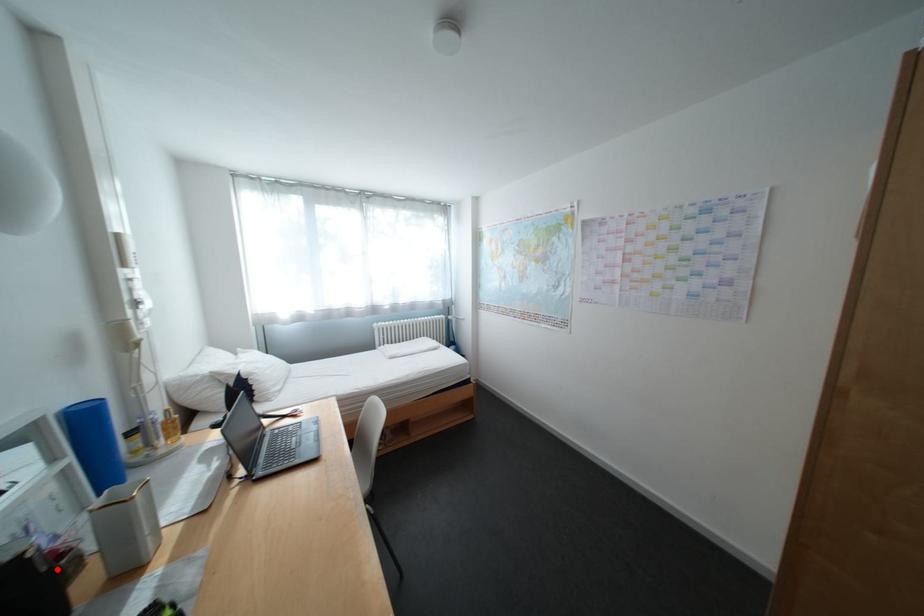
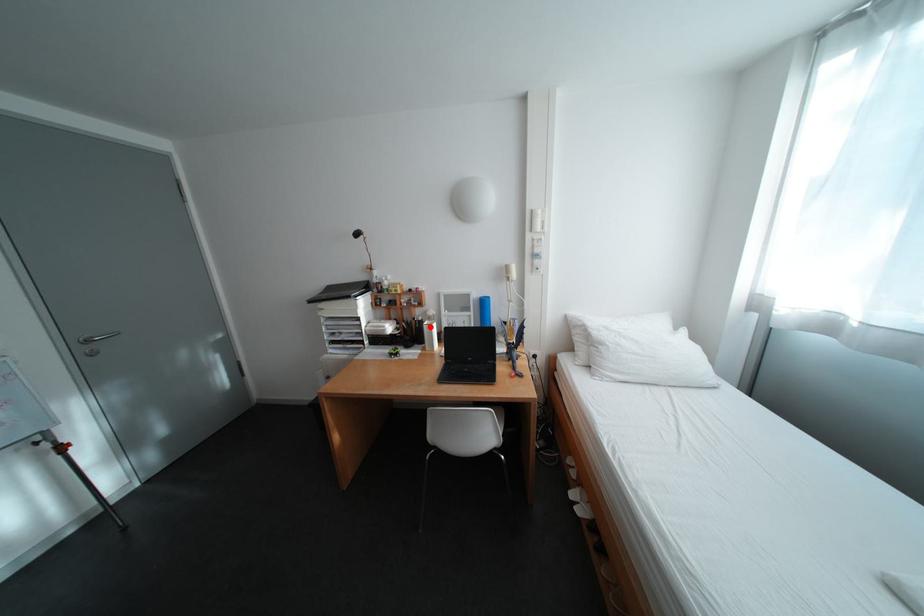
I am providing you with two images of the same scene from different viewpoints. A red point is marked on the first image and another point is marked on the second image. Are the points marked in image1 and image2 representing the same 3D position?

Yes